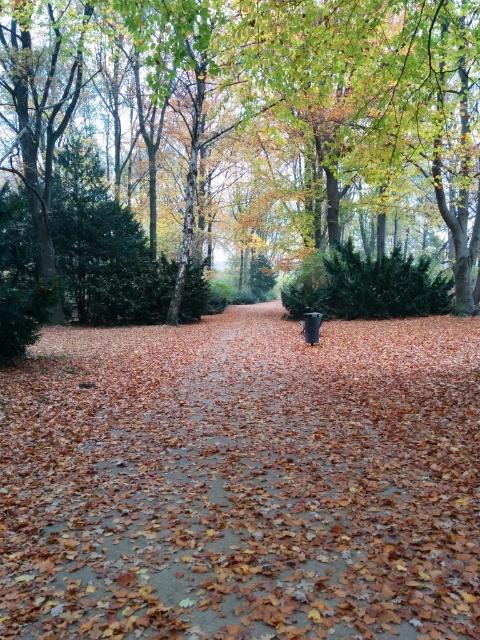
You are standing at the starting point of the path in the autumn scene. There are two points marked on the path. One is at coordinates point (398,557) and the other at point (387,4). If you want to walk towards the point that is further away from you, which coordinate should you head towards?

Point (398,557) is in front of point (387,4). Therefore, to walk towards the point that is further away from you, you should head towards point (398,557).